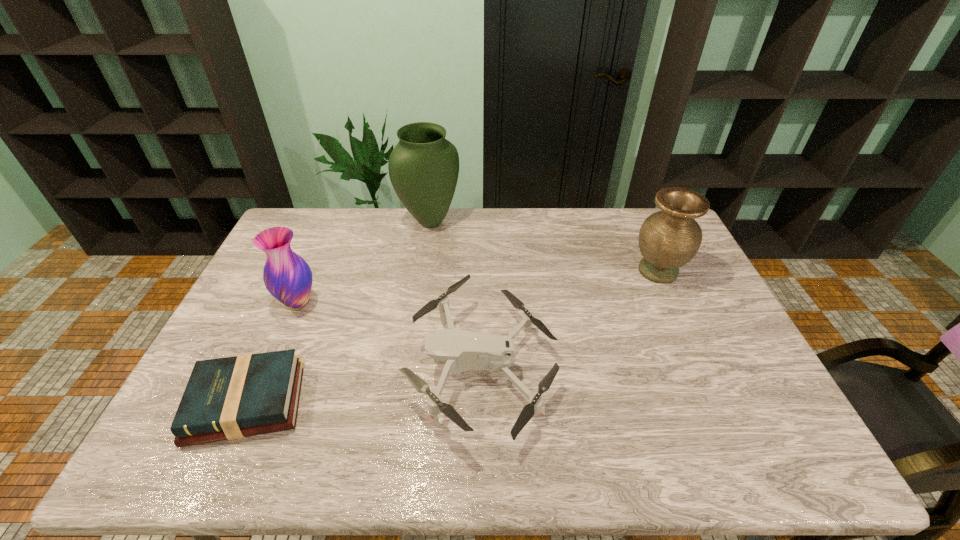
The height and width of the screenshot is (540, 960). I want to click on vacant space located with a camera at the front of the fourth tallest object, so click(x=386, y=367).

This screenshot has height=540, width=960. I want to click on free region located 0.250m with a camera at the front of the fourth tallest object, so (x=315, y=367).

Find the location of `free spot located on the back of the shortest object`. free spot located on the back of the shortest object is located at coordinates (305, 272).

This screenshot has height=540, width=960. Identify the location of object that is at the far edge. click(423, 167).

Identify the location of drone at the near edge. This screenshot has height=540, width=960. (460, 351).

In order to click on hardback book that is at the near edge in this screenshot , I will do `click(229, 398)`.

What are the coordinates of `vase present at the left edge` in the screenshot? It's located at (287, 276).

You are a GUI agent. You are given a task and a screenshot of the screen. Output one action in this format:
    pyautogui.click(x=<x>, y=<y>)
    Task: Click on the hardback book that is at the left edge
    
    Given the screenshot: What is the action you would take?
    pyautogui.click(x=229, y=398)

Locate an element on the screen. The width and height of the screenshot is (960, 540). object at the right edge is located at coordinates (668, 239).

Where is `object located in the near left corner section of the desktop`? This screenshot has width=960, height=540. object located in the near left corner section of the desktop is located at coordinates (229, 398).